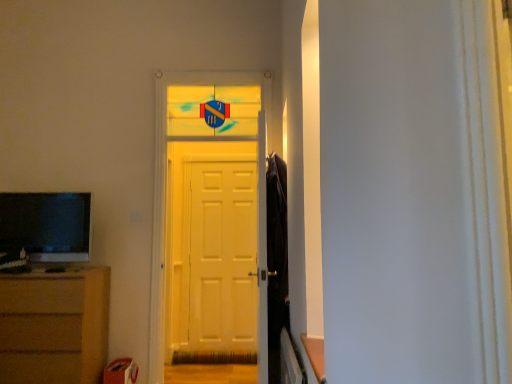
Question: Is matte black television at left directly adjacent to white matte door at center?

Choices:
 (A) no
 (B) yes

Answer: (A)

Question: Is matte black television at left looking in the opposite direction of white matte door at center?

Choices:
 (A) yes
 (B) no

Answer: (B)

Question: Is matte black television at left facing towards white matte door at center?

Choices:
 (A) no
 (B) yes

Answer: (A)

Question: Considering the relative sizes of matte black television at left and white matte door at center in the image provided, is matte black television at left wider than white matte door at center?

Choices:
 (A) yes
 (B) no

Answer: (A)

Question: Is the position of matte black television at left more distant than that of white matte door at center?

Choices:
 (A) yes
 (B) no

Answer: (B)

Question: Does matte black television at left have a larger size compared to white matte door at center?

Choices:
 (A) yes
 (B) no

Answer: (B)

Question: Considering the relative sizes of white matte door at center and brown wooden chest of drawers at lower left in the image provided, is white matte door at center shorter than brown wooden chest of drawers at lower left?

Choices:
 (A) no
 (B) yes

Answer: (A)

Question: From a real-world perspective, is white matte door at center located beneath brown wooden chest of drawers at lower left?

Choices:
 (A) no
 (B) yes

Answer: (A)

Question: Does white matte door at center have a greater height compared to brown wooden chest of drawers at lower left?

Choices:
 (A) no
 (B) yes

Answer: (B)

Question: Could brown wooden chest of drawers at lower left be considered to be inside white matte door at center?

Choices:
 (A) no
 (B) yes

Answer: (A)

Question: Does white matte door at center appear on the left side of brown wooden chest of drawers at lower left?

Choices:
 (A) no
 (B) yes

Answer: (A)

Question: From the image's perspective, does white matte door at center appear higher than brown wooden chest of drawers at lower left?

Choices:
 (A) no
 (B) yes

Answer: (B)

Question: Considering the relative sizes of white glossy door at center and matte black television at left in the image provided, is white glossy door at center taller than matte black television at left?

Choices:
 (A) no
 (B) yes

Answer: (B)